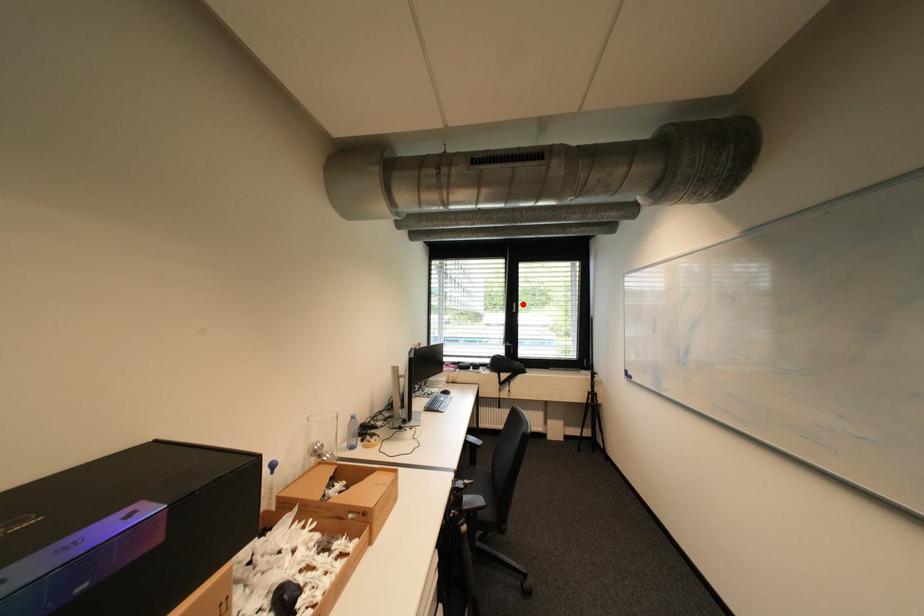
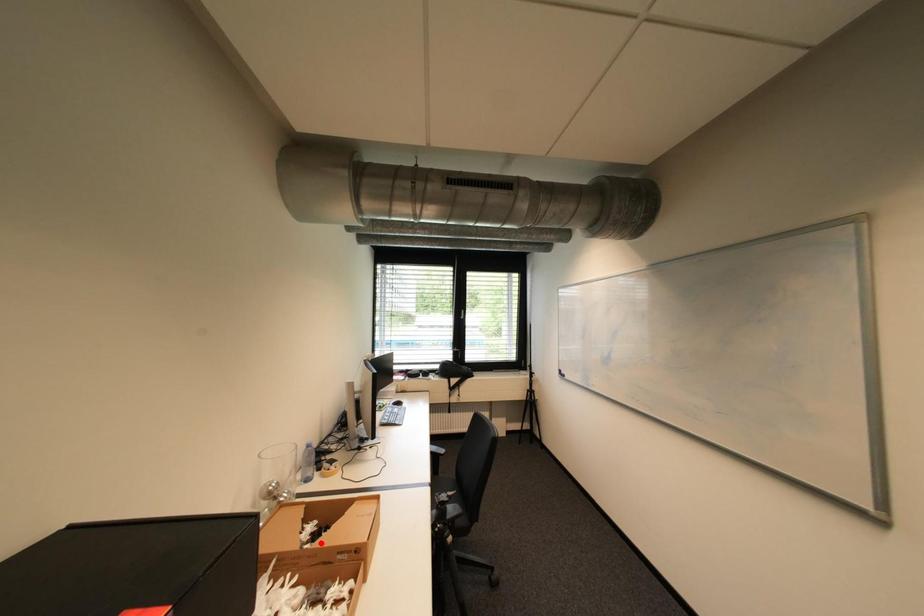
I am providing you with two images of the same scene from different viewpoints. A red point is marked on the first image and another point is marked on the second image. Do the highlighted points in image1 and image2 indicate the same real-world spot?

No